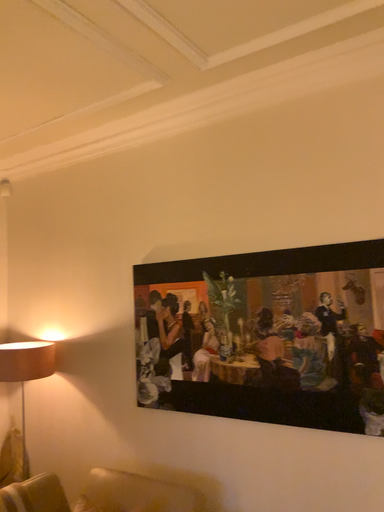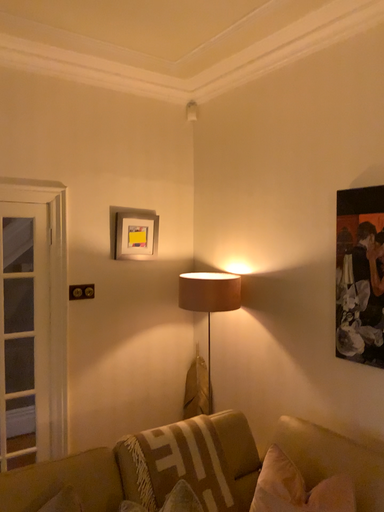
Question: Which way did the camera rotate in the video?

Choices:
 (A) rotated right
 (B) rotated left

Answer: (B)